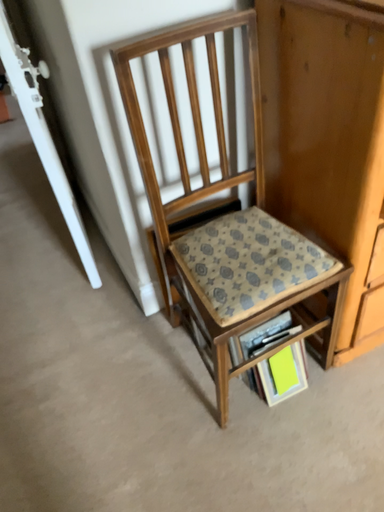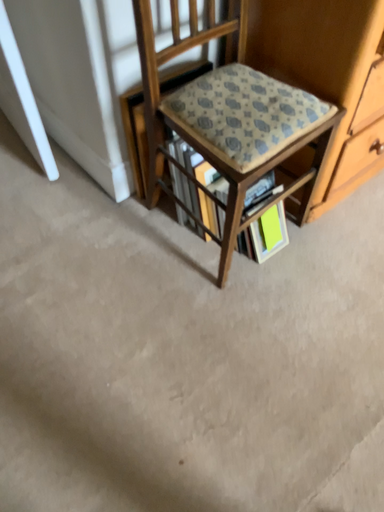
Question: How did the camera likely rotate when shooting the video?

Choices:
 (A) rotated upward
 (B) rotated downward

Answer: (B)